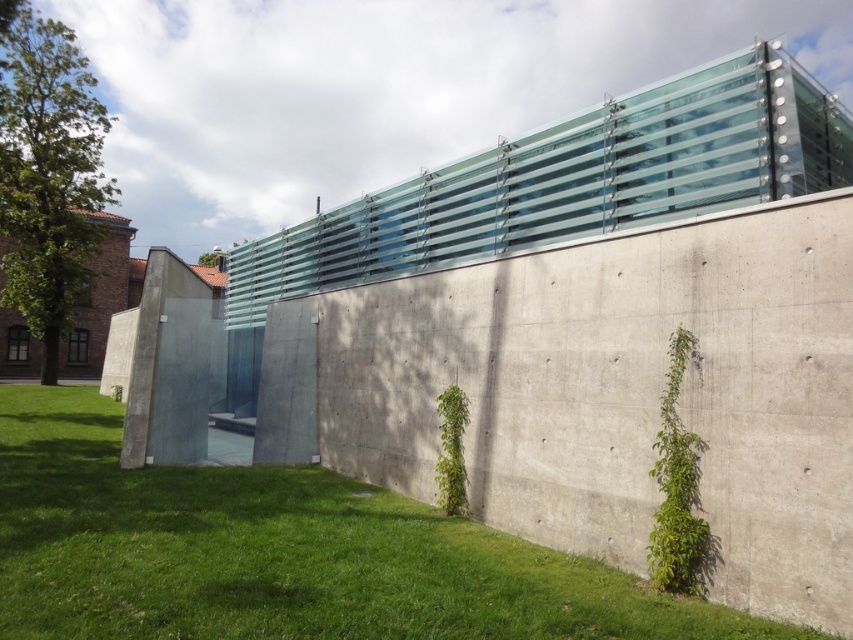
You are a landscape architect designing a garden. You have two plants to place in the scene described. The green grass at lower left and the green leafy ivy at center. Which plant has a larger width in the image?

The green grass at lower left might be wider than green leafy ivy at center according to the description.

You are standing in front of the modern architectural structure and notice two green leafy ivy plants. Which ivy is closer to you, the green leafy ivy at lower right or the green leafy ivy at center?

The green leafy ivy at lower right is closer to you because it is positioned over the green leafy ivy at center, indicating it is in front.